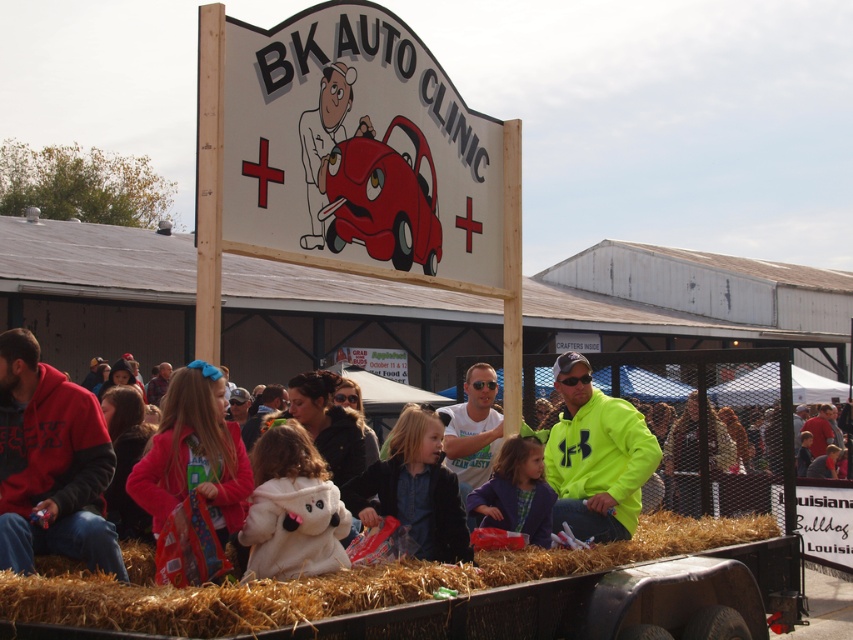
Question: Which of these objects is positioned farthest from the white matte doctor at center?

Choices:
 (A) wooden signboard at center
 (B) straw hay at center
 (C) neon green jacket at center
 (D) red fleece hoodie at left

Answer: (B)

Question: Which of the following is the closest to the observer?

Choices:
 (A) white matte doctor at center
 (B) red fleece hoodie at left

Answer: (B)

Question: Can you confirm if neon green jacket at center is positioned to the right of white matte doctor at center?

Choices:
 (A) no
 (B) yes

Answer: (B)

Question: Considering the relative positions of wooden signboard at center and neon yellow jacket at center in the image provided, where is wooden signboard at center located with respect to neon yellow jacket at center?

Choices:
 (A) left
 (B) right

Answer: (A)

Question: Does red fleece hoodie at left have a smaller size compared to neon yellow jacket at center?

Choices:
 (A) no
 (B) yes

Answer: (B)

Question: Which object appears farthest from the camera in this image?

Choices:
 (A) white matte doctor at center
 (B) red fleece hoodie at left
 (C) neon yellow jacket at center
 (D) straw hay at center

Answer: (A)